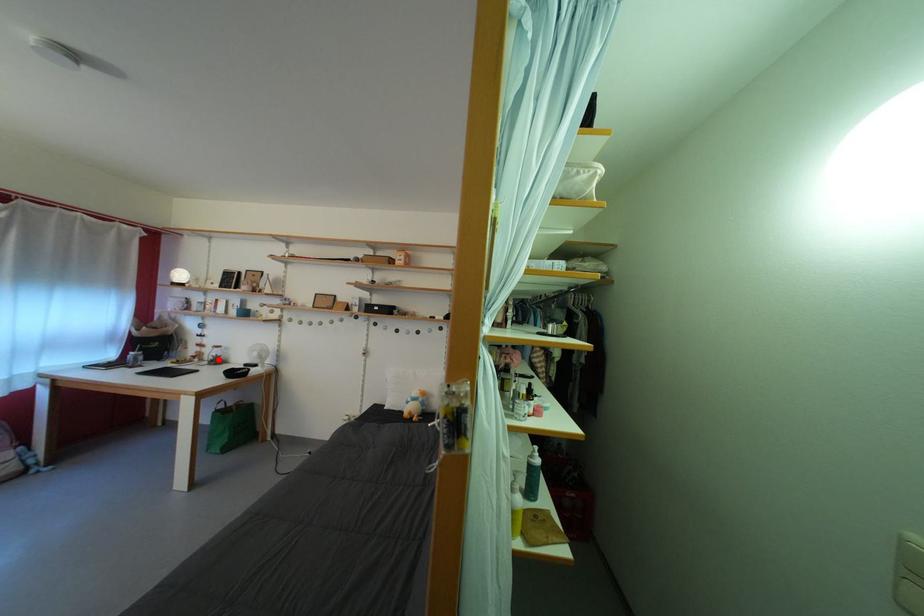
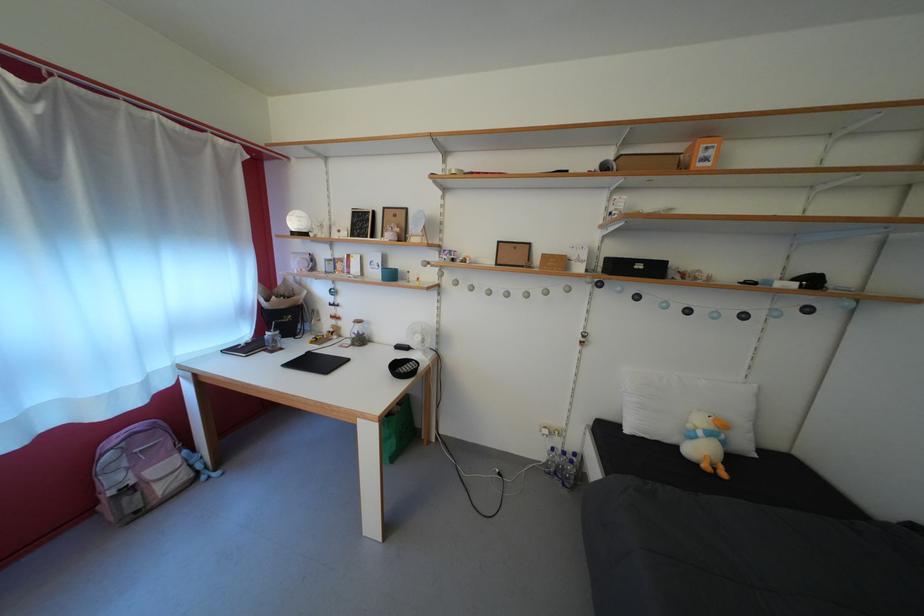
Locate, in the second image, the point that corresponds to the highlighted location in the first image.

(358, 334)